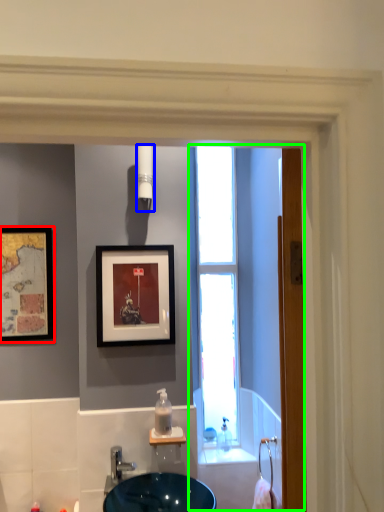
Question: Which is farther away from picture frame (highlighted by a red box)? light fixture (highlighted by a blue box) or screen door (highlighted by a green box)?

Choices:
 (A) light fixture
 (B) screen door

Answer: (B)